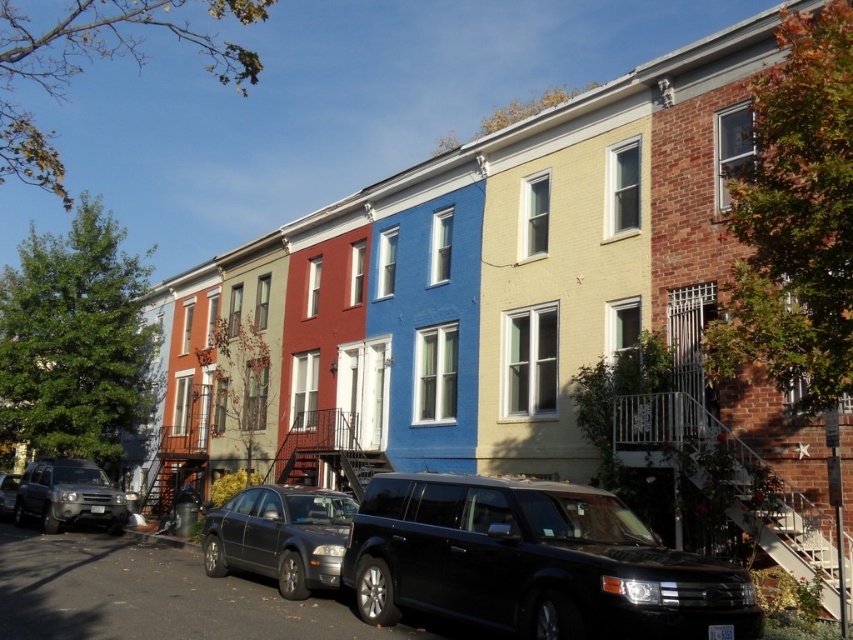
Who is positioned more to the left, shiny black suv at center or silver metallic suv at lower left?

From the viewer's perspective, silver metallic suv at lower left appears more on the left side.

Between shiny black suv at center and silver metallic suv at lower left, which one is positioned lower?

silver metallic suv at lower left is below.

Image resolution: width=853 pixels, height=640 pixels. What are the coordinates of `shiny black suv at center` in the screenshot? It's located at (531, 563).

Where is `metallic gray sedan at center`? The width and height of the screenshot is (853, 640). metallic gray sedan at center is located at coordinates (279, 536).

Does point (283, 516) lie behind point (57, 506)?

No.

Is point (314, 520) more distant than point (74, 464)?

No, (314, 520) is in front of (74, 464).

I want to click on metallic gray sedan at center, so click(279, 536).

Is silver metallic suv at lower left bigger than matte silver suv at lower left?

Correct, silver metallic suv at lower left is larger in size than matte silver suv at lower left.

Is point (45, 467) in front of point (10, 493)?

That is True.

The image size is (853, 640). Identify the location of silver metallic suv at lower left. (68, 496).